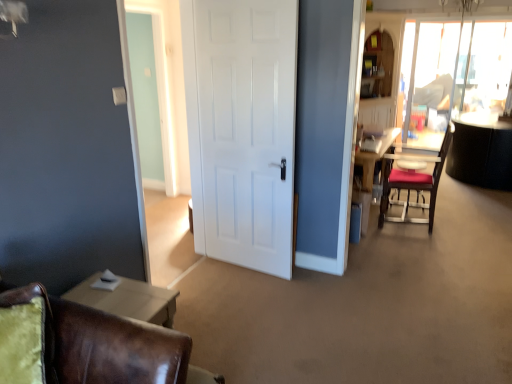
Find the location of a particular element. free space in front of velvet red chair at right, positioned as the first chair in top-to-bottom order is located at coordinates (434, 247).